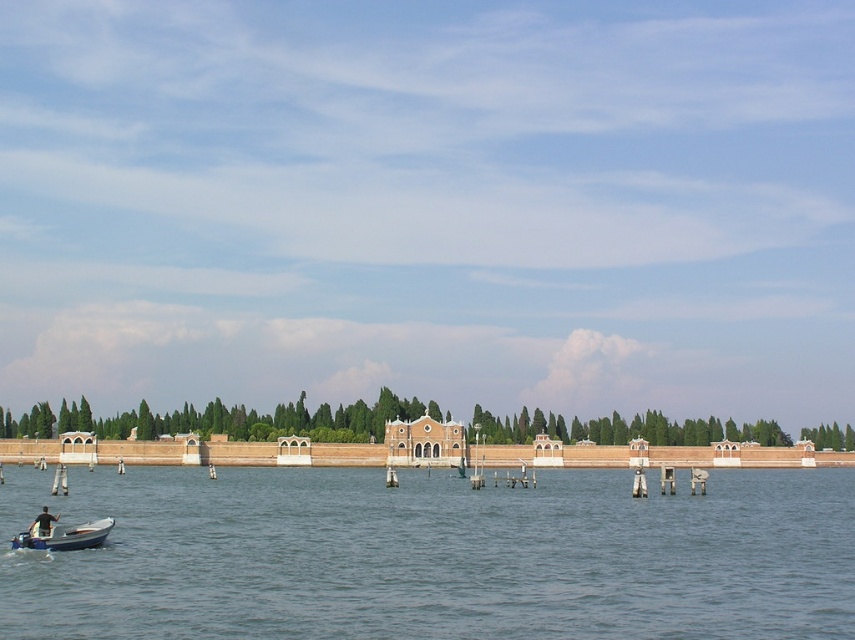
Question: Which point is closer to the camera taking this photo?

Choices:
 (A) (51, 516)
 (B) (89, 540)
 (C) (151, 497)

Answer: (B)

Question: Does blue plastic boat at lower left lie in front of dark blue fabric at lower left?

Choices:
 (A) yes
 (B) no

Answer: (A)

Question: Among these objects, which one is nearest to the camera?

Choices:
 (A) clear water at lower left
 (B) blue plastic boat at lower left

Answer: (A)

Question: Does clear water at lower left lie in front of blue plastic boat at lower left?

Choices:
 (A) no
 (B) yes

Answer: (B)

Question: Which point is closer to the camera?

Choices:
 (A) (237, 493)
 (B) (49, 531)

Answer: (B)

Question: Can you confirm if clear water at lower left is thinner than dark blue fabric at lower left?

Choices:
 (A) no
 (B) yes

Answer: (A)